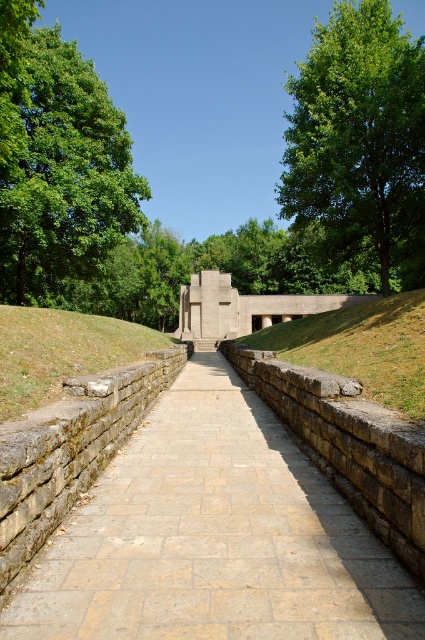
Question: Can you confirm if stone paved path at center is smaller than green leafy tree at upper right?

Choices:
 (A) yes
 (B) no

Answer: (A)

Question: Which is farther from the green leafy tree at left?

Choices:
 (A) stone paved path at center
 (B) green grassy hillside at center
 (C) green leafy tree at upper right

Answer: (A)

Question: Does stone paved path at center have a greater width compared to green leafy tree at left?

Choices:
 (A) yes
 (B) no

Answer: (B)

Question: Among these points, which one is farthest from the camera?

Choices:
 (A) (333, 17)
 (B) (138, 460)

Answer: (A)

Question: Estimate the real-world distances between objects in this image. Which object is farther from the brown stone wall at lower left?

Choices:
 (A) green leafy tree at upper right
 (B) stone paved path at center

Answer: (A)

Question: In this image, where is green grassy hillside at center located relative to brown stone wall at lower left?

Choices:
 (A) right
 (B) left

Answer: (A)